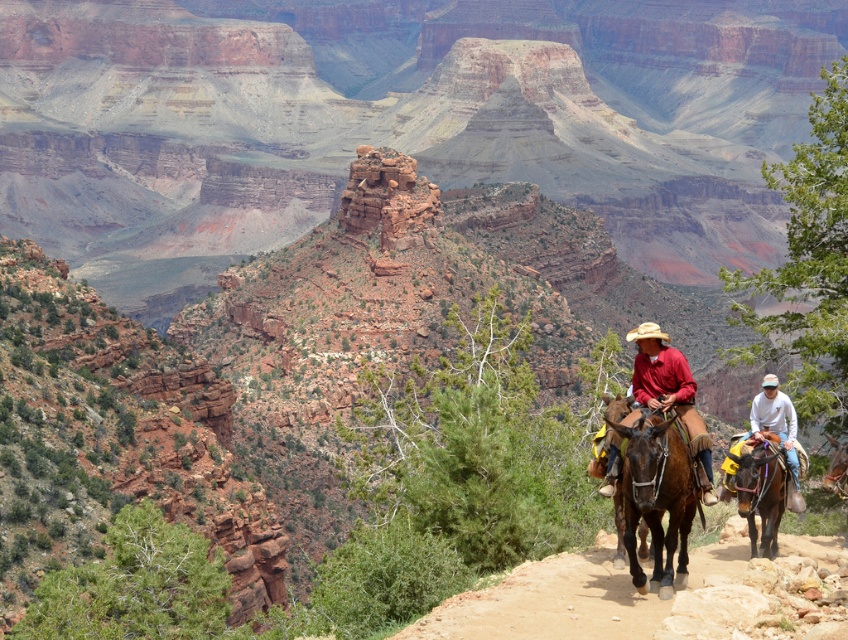
Is matte red shirt at center wider than brown leather horse at right?

Indeed, matte red shirt at center has a greater width compared to brown leather horse at right.

Is matte red shirt at center to the right of brown leather horse at right from the viewer's perspective?

Indeed, matte red shirt at center is positioned on the right side of brown leather horse at right.

Is point (706, 442) farther from camera compared to point (745, 512)?

No, it is not.

What are the coordinates of `matte red shirt at center` in the screenshot? It's located at (670, 392).

Is brown leather horse at right above brown leather saddle at lower right?

Actually, brown leather horse at right is below brown leather saddle at lower right.

Is point (752, 513) less distant than point (826, 433)?

Yes, it is in front of point (826, 433).

In order to click on brown leather horse at right in this screenshot , I will do `click(762, 492)`.

Does point (684, 497) come farther from viewer compared to point (684, 406)?

No, (684, 497) is in front of (684, 406).

Is brown glossy horse at center above matte red shirt at center?

Incorrect, brown glossy horse at center is not positioned above matte red shirt at center.

This screenshot has width=848, height=640. Describe the element at coordinates (656, 496) in the screenshot. I see `brown glossy horse at center` at that location.

Find the location of a particular element. Image resolution: width=848 pixels, height=640 pixels. brown glossy horse at center is located at coordinates tap(656, 496).